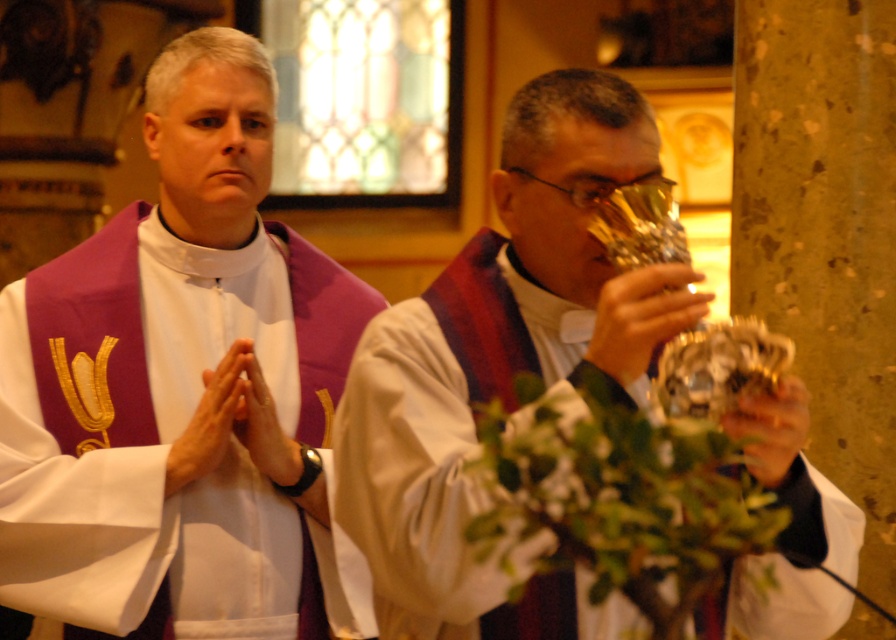
Who is more distant from viewer, (240, 163) or (533, 602)?

Positioned behind is point (240, 163).

Consider the image. Is purple velvet stole at center to the left of metallic gold chalice at center from the viewer's perspective?

Yes, purple velvet stole at center is to the left of metallic gold chalice at center.

Find the location of a particular element. This screenshot has height=640, width=896. purple velvet stole at center is located at coordinates click(182, 392).